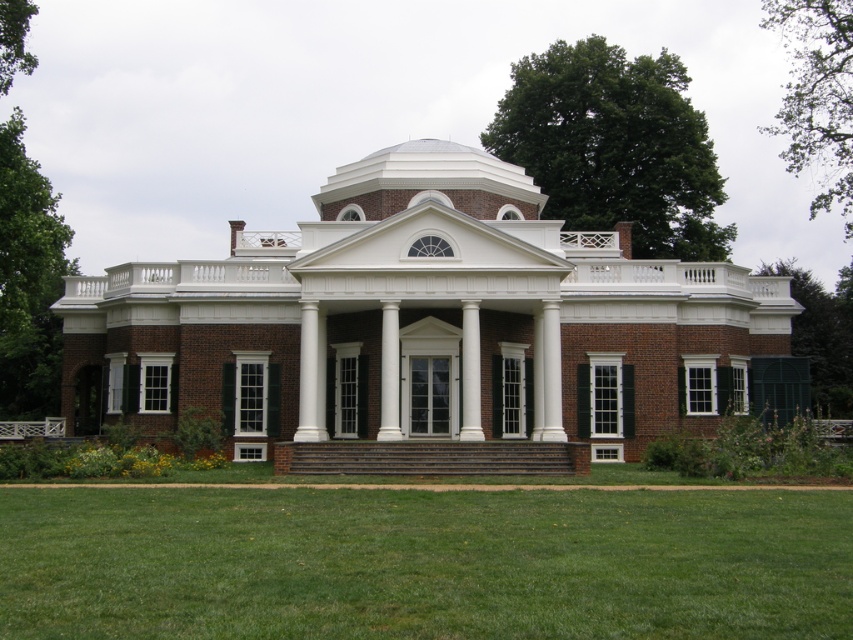
Question: Can you confirm if brick mansion at center is thinner than green grass at lower center?

Choices:
 (A) no
 (B) yes

Answer: (A)

Question: Which object is farther from the camera taking this photo?

Choices:
 (A) green grass at lower center
 (B) brick mansion at center

Answer: (B)

Question: Which point is closer to the camera taking this photo?

Choices:
 (A) (526, 547)
 (B) (532, 220)

Answer: (A)

Question: Is brick mansion at center behind green grass at lower center?

Choices:
 (A) yes
 (B) no

Answer: (A)

Question: Where is brick mansion at center located in relation to green grass at lower center in the image?

Choices:
 (A) right
 (B) left

Answer: (B)

Question: Which object appears closest to the camera in this image?

Choices:
 (A) brown wooden stairs at center
 (B) green grass at lower center
 (C) brick mansion at center

Answer: (B)